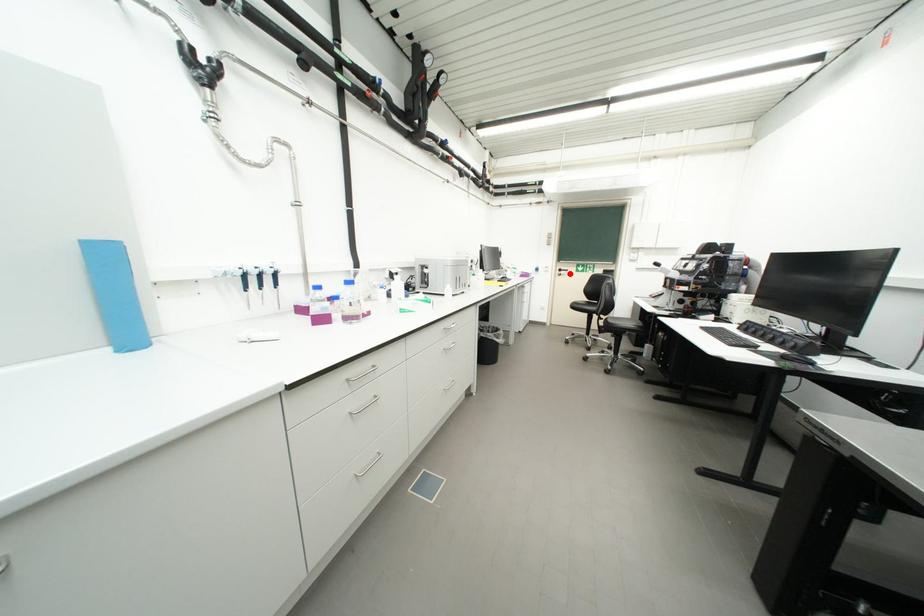
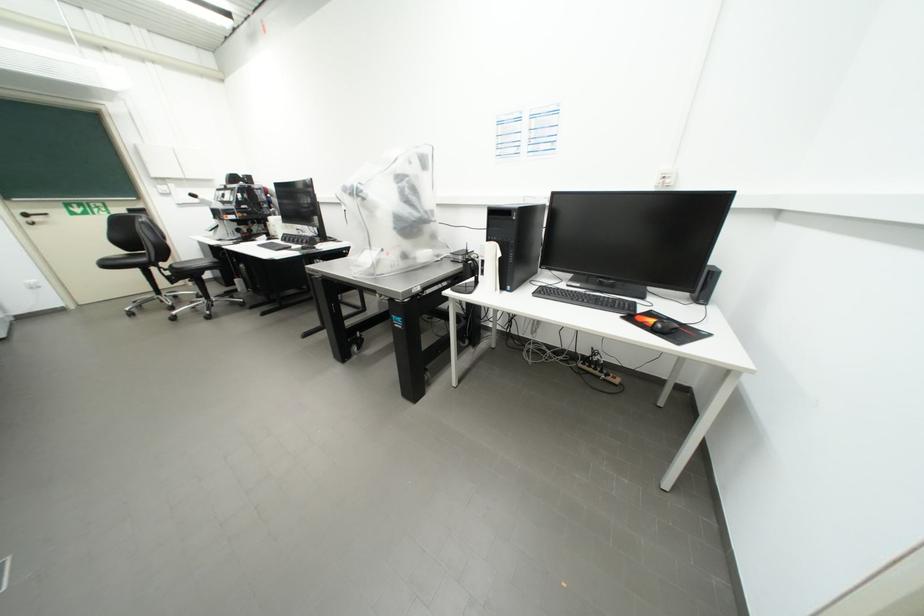
In the second image, find the point that corresponds to the highlighted location in the first image.

(43, 220)